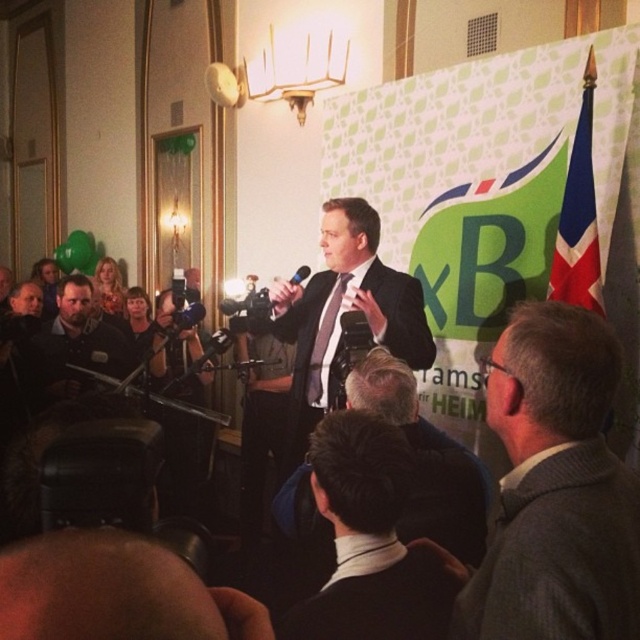
Question: Which of the following is the closest to the observer?

Choices:
 (A) (112, 332)
 (B) (408, 413)
 (C) (51, 259)

Answer: (B)

Question: Which object is positioned farthest from the matte black jacket at upper left?

Choices:
 (A) black matte microphone at center
 (B) matte black suit at center

Answer: (A)

Question: Does dark gray shirt at left have a greater width compared to matte black jacket at upper left?

Choices:
 (A) yes
 (B) no

Answer: (B)

Question: Is blonde hair at upper left thinner than black matte microphone at center?

Choices:
 (A) yes
 (B) no

Answer: (B)

Question: Can you confirm if dark suit at center is bigger than blonde hair at upper left?

Choices:
 (A) no
 (B) yes

Answer: (B)

Question: Which of these objects is positioned closest to the blonde hair at upper left?

Choices:
 (A) dark gray shirt at left
 (B) matte black jacket at upper left
 (C) gray wool suit at center
 (D) black matte microphone at center

Answer: (B)